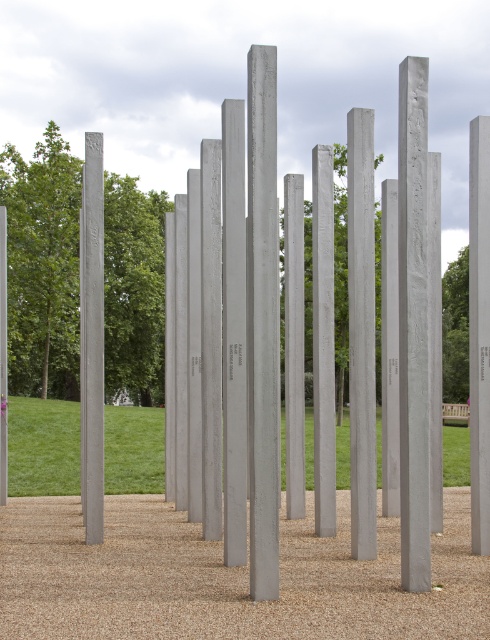
Question: Which is farther from the sanded concrete pillars at center?

Choices:
 (A) sanded concrete pole at left
 (B) gray concrete pole at center
 (C) sanded concrete pillar at center

Answer: (A)

Question: Can you confirm if gray concrete pole at center is smaller than satin silver pole at right?

Choices:
 (A) no
 (B) yes

Answer: (B)

Question: Based on their relative distances, which object is nearer to the sanded concrete pillar at right?

Choices:
 (A) sanded concrete pole at left
 (B) satin gray pole at center
 (C) sanded concrete pole at center
 (D) gray concrete pole at center

Answer: (C)

Question: Is sanded concrete pole at center below gray concrete pole at center?

Choices:
 (A) yes
 (B) no

Answer: (B)

Question: Which of the following is the closest to the observer?

Choices:
 (A) (412, 584)
 (B) (231, 342)

Answer: (A)

Question: Is sanded concrete pillars at center wider than satin gray pole at center?

Choices:
 (A) no
 (B) yes

Answer: (A)